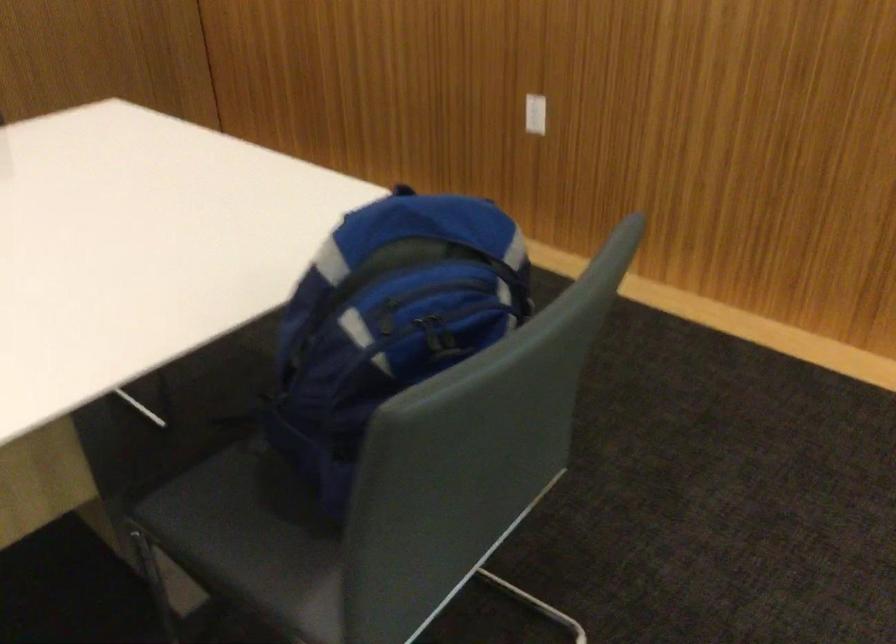
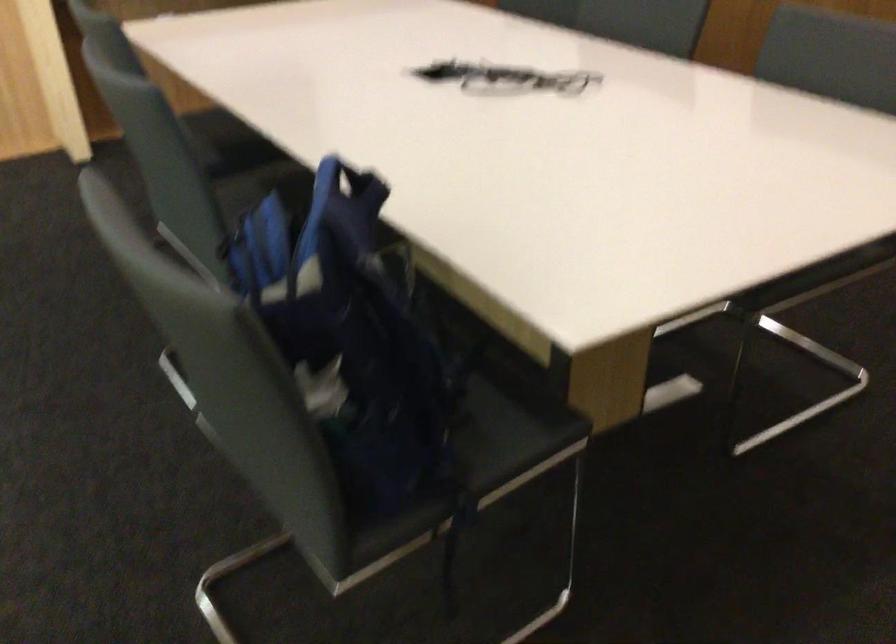
Find the pixel in the second image that matches (x=322, y=238) in the first image.

(349, 184)